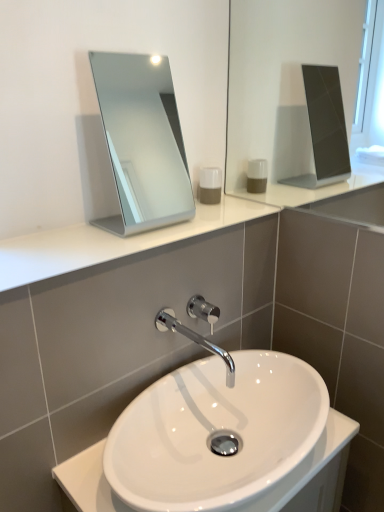
Question: In terms of size, does white glossy countertop at upper center, arranged as the 1th counter top when viewed from the top, appear bigger or smaller than silver metallic mirror at upper center?

Choices:
 (A) big
 (B) small

Answer: (B)

Question: From a real-world perspective, relative to silver metallic mirror at upper center, is white glossy countertop at upper center, arranged as the 1th counter top when viewed from the top, vertically above or below?

Choices:
 (A) above
 (B) below

Answer: (B)

Question: Considering the real-world distances, which object is closest to the silver metallic mirror at upper center?

Choices:
 (A) translucent plastic soap dispenser at center
 (B) polished chrome faucet at center
 (C) chrome/metallic faucet at center
 (D) white glossy sink at center, the second counter top viewed from the top
 (E) white glossy countertop at upper center, arranged as the 1th counter top when viewed from the top

Answer: (A)

Question: Based on their relative distances, which object is nearer to the translucent plastic soap dispenser at center?

Choices:
 (A) white glossy sink at center
 (B) polished chrome faucet at center
 (C) white glossy sink at center, the second counter top viewed from the top
 (D) chrome/metallic faucet at center
 (E) white glossy countertop at upper center, positioned as the 2th counter top in bottom-to-top order

Answer: (E)